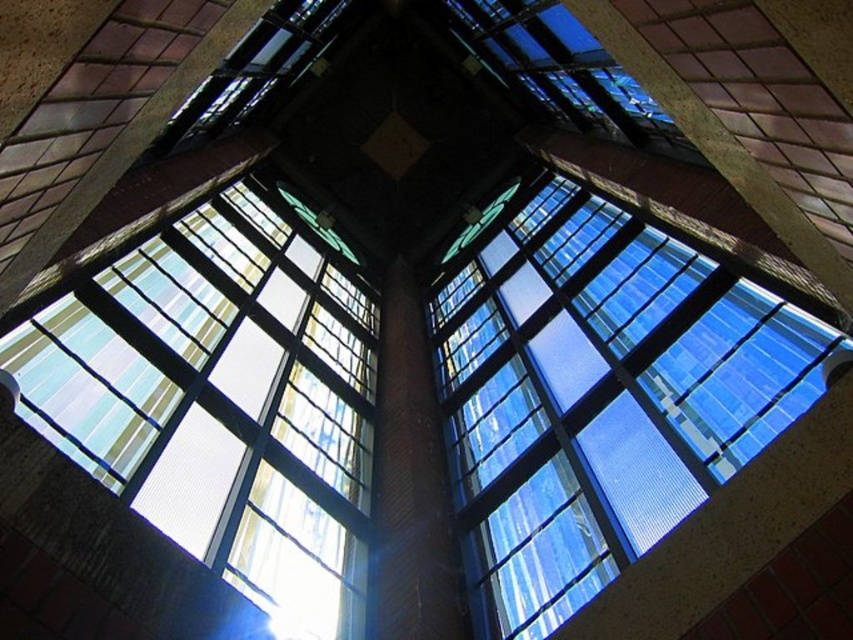
Does transparent glass window at upper center have a lesser height compared to red brick pillar at center?

No.

Is transparent glass window at upper center smaller than red brick pillar at center?

Incorrect, transparent glass window at upper center is not smaller in size than red brick pillar at center.

Does point (529, 444) lie behind point (419, 596)?

Yes, it is.

You are a GUI agent. You are given a task and a screenshot of the screen. Output one action in this format:
    pyautogui.click(x=<x>, y=<y>)
    Task: Click on the transparent glass window at upper center
    
    Given the screenshot: What is the action you would take?
    pyautogui.click(x=599, y=396)

Does point (625, 401) lie in front of point (300, 336)?

Yes, it is in front of point (300, 336).

Could you measure the distance between transparent glass window at upper center and translucent glass window at upper left?

A distance of 9.66 meters exists between transparent glass window at upper center and translucent glass window at upper left.

Measure the distance between transparent glass window at upper center and camera.

transparent glass window at upper center and camera are 15.63 meters apart from each other.

Locate an element on the screen. The height and width of the screenshot is (640, 853). transparent glass window at upper center is located at coordinates (599, 396).

Is translucent glass window at upper left above red brick pillar at center?

Indeed, translucent glass window at upper left is positioned over red brick pillar at center.

Can you confirm if translucent glass window at upper left is shorter than red brick pillar at center?

In fact, translucent glass window at upper left may be taller than red brick pillar at center.

Identify the location of translucent glass window at upper left. The width and height of the screenshot is (853, 640). (223, 397).